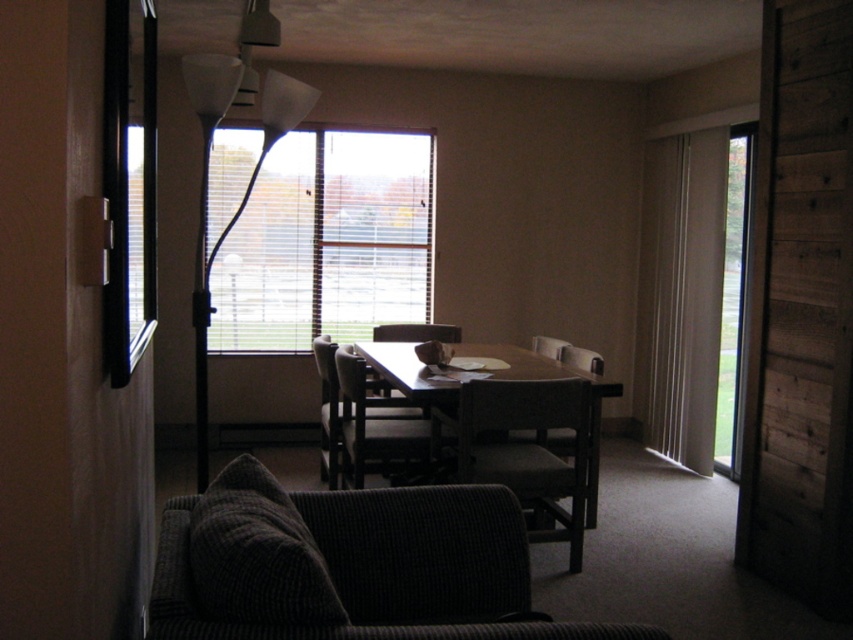
Question: Is dark gray fabric chair at center closer to the viewer compared to matte brown chair at center?

Choices:
 (A) yes
 (B) no

Answer: (A)

Question: Which point is closer to the camera taking this photo?

Choices:
 (A) (497, 372)
 (B) (370, 468)
 (C) (344, 273)

Answer: (A)

Question: Which point is closer to the camera?

Choices:
 (A) wooden table at center
 (B) matte brown chair at center
 (C) transparent glass door at right

Answer: (A)

Question: Does wooden chair at center appear on the right side of matte brown chair at center?

Choices:
 (A) yes
 (B) no

Answer: (B)

Question: Which point is closer to the camera?

Choices:
 (A) (558, 368)
 (B) (252, 211)
 (C) (219, 236)

Answer: (C)

Question: Is wooden dining chair at center positioned before matte brown chair at center?

Choices:
 (A) no
 (B) yes

Answer: (A)